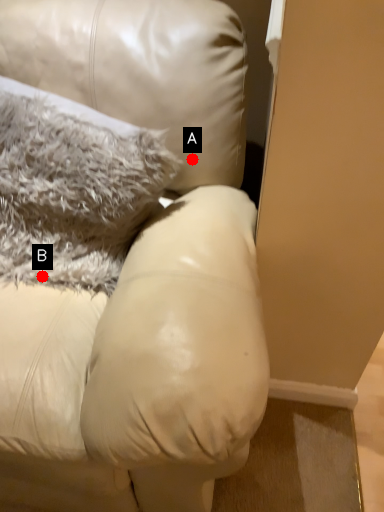
Question: Two points are circled on the image, labeled by A and B beside each circle. Which point appears closest to the camera in this image?

Choices:
 (A) A is closer
 (B) B is closer

Answer: (B)